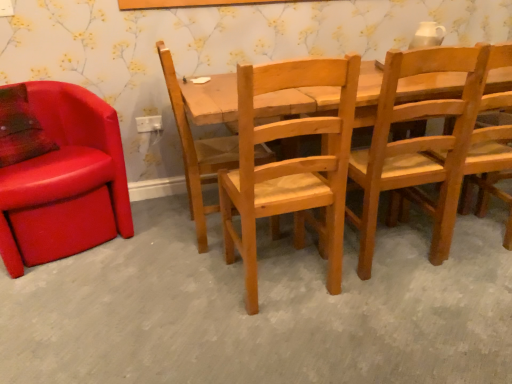
This screenshot has width=512, height=384. Identify the location of vacant area that lies between natural wood chair at center, which appears as the fourth chair when viewed from the right, and natural wood chair at center, placed as the third chair when sorted from left to right. (226, 268).